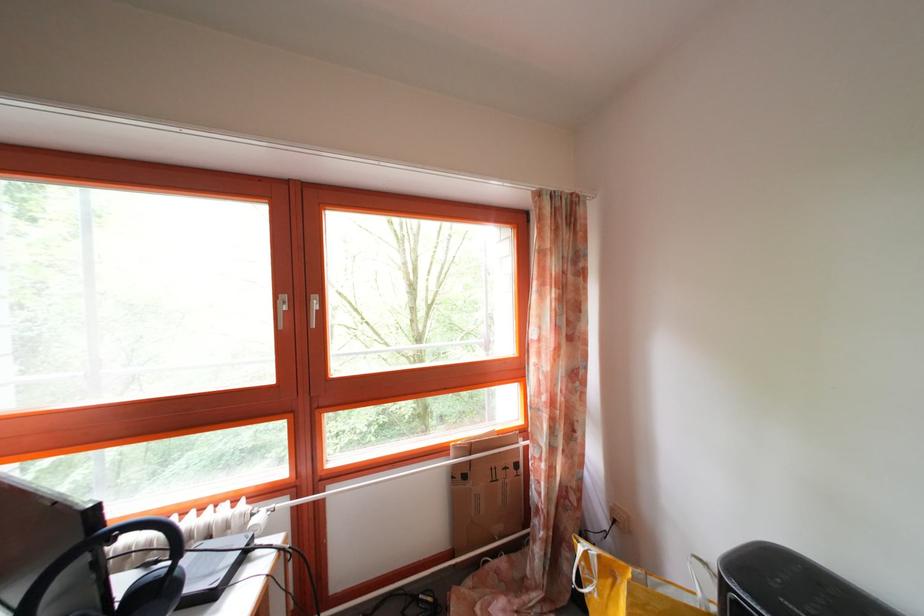
Where is `white bag handle`? white bag handle is located at coordinates (584, 580).